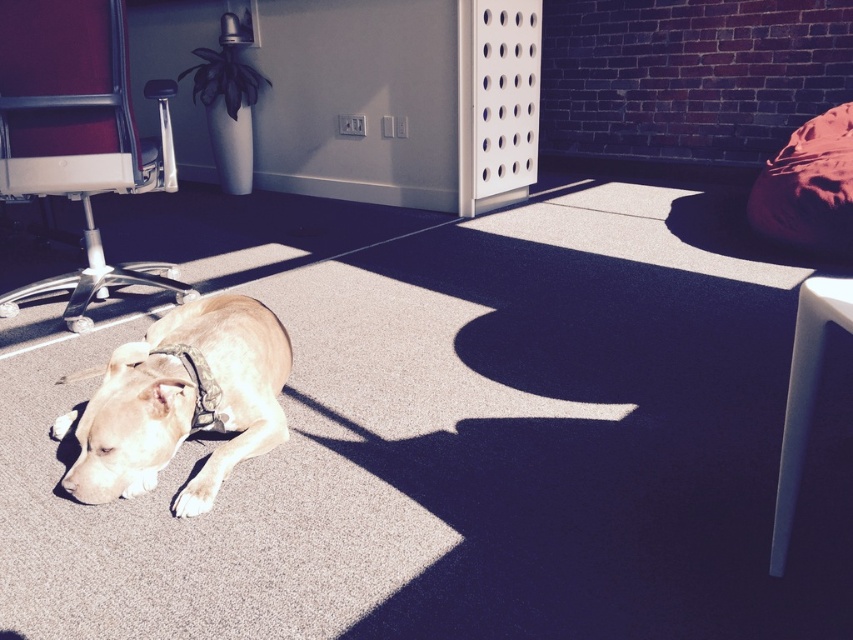
Question: Which object is positioned farthest from the light brown fur at center?

Choices:
 (A) black fabric neckband at lower left
 (B) metallic silver office chair at left

Answer: (B)

Question: In this image, where is light brown fur at center located relative to black fabric neckband at lower left?

Choices:
 (A) right
 (B) left

Answer: (B)

Question: Which point is closer to the camera?

Choices:
 (A) metallic silver office chair at left
 (B) white plastic stool at lower right
 (C) light brown fur at center
 (D) black fabric neckband at lower left

Answer: (B)

Question: Which point is farther from the camera taking this photo?

Choices:
 (A) (792, 401)
 (B) (189, 358)

Answer: (B)

Question: Is white plastic stool at lower right to the left of black fabric neckband at lower left from the viewer's perspective?

Choices:
 (A) yes
 (B) no

Answer: (B)

Question: Is metallic silver office chair at left further to the viewer compared to white plastic stool at lower right?

Choices:
 (A) no
 (B) yes

Answer: (B)